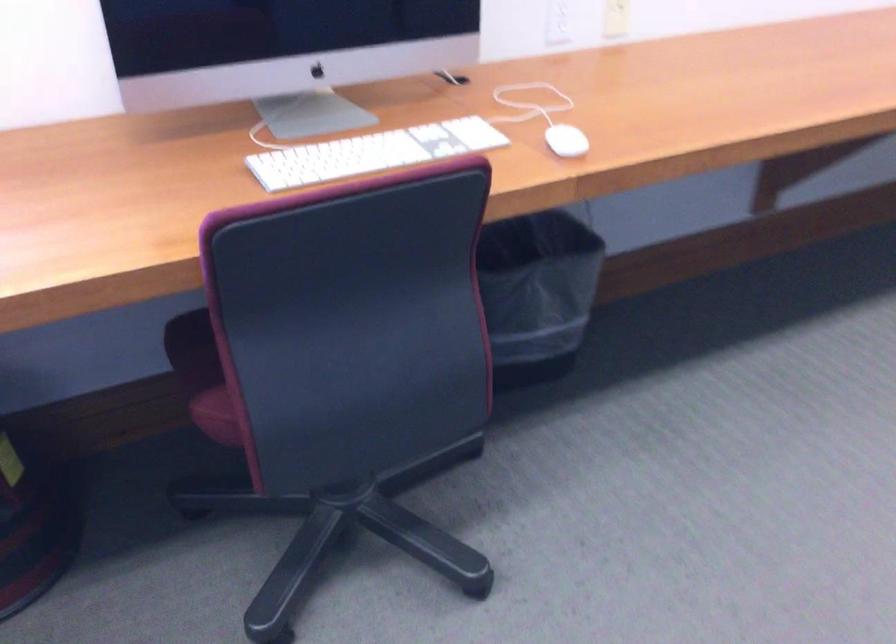
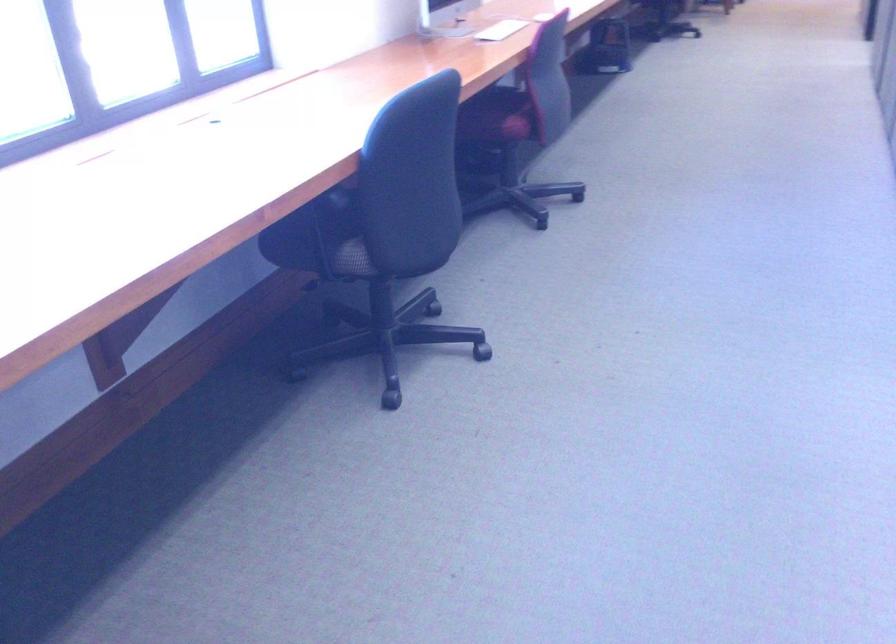
In the second image, find the point that corresponds to pixel 311 174 in the first image.

(501, 30)